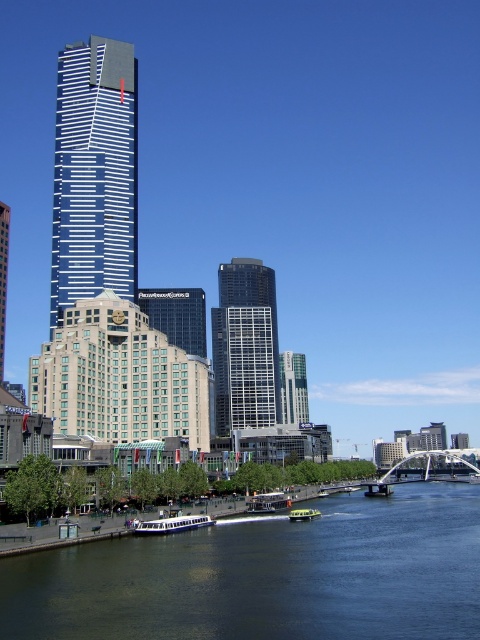
Question: Which object is the closest to the dark blue water at lower center?

Choices:
 (A) dark glass skyscraper at center
 (B) glassy reflective skyscraper at center
 (C) white plastic boat at center
 (D) glassy blue skyscraper at center

Answer: (C)

Question: Is white glass skyscraper at center to the left of green matte boat at center from the viewer's perspective?

Choices:
 (A) no
 (B) yes

Answer: (B)

Question: Observing the image, what is the correct spatial positioning of white glass skyscraper at center in reference to green matte boat at center?

Choices:
 (A) right
 (B) left

Answer: (B)

Question: Which point appears closest to the camera in this image?

Choices:
 (A) (178, 298)
 (B) (126, 193)

Answer: (B)

Question: From the image, what is the correct spatial relationship of dark glass skyscraper at center in relation to glassy blue skyscraper at center?

Choices:
 (A) right
 (B) left

Answer: (A)

Question: Which point is farther to the camera?

Choices:
 (A) (117, 180)
 (B) (173, 525)

Answer: (A)